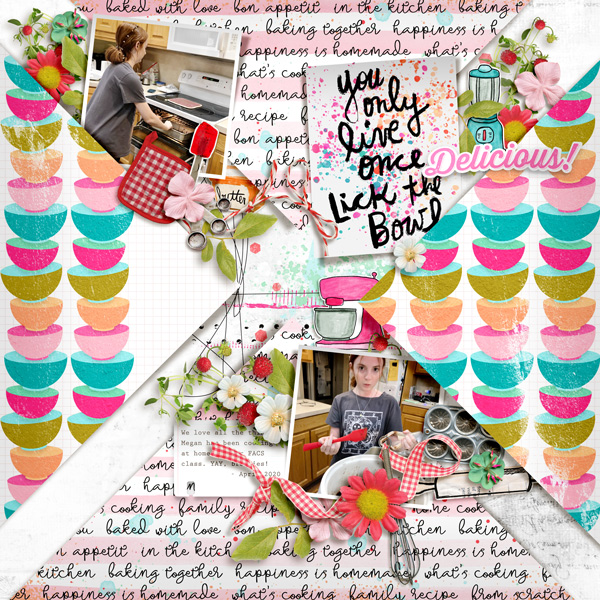
The height and width of the screenshot is (600, 600). Find the location of `oven`. oven is located at coordinates (176, 141).